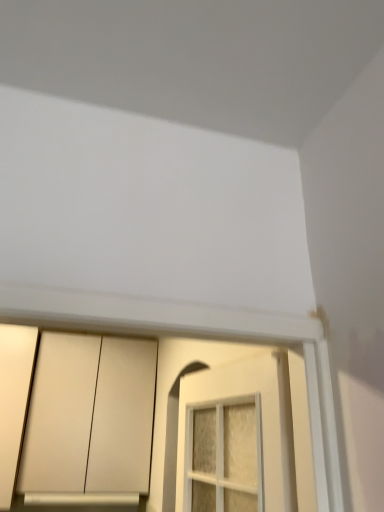
Question: Is matte white cabinet at lower left taller or shorter than matte white door at lower left?

Choices:
 (A) tall
 (B) short

Answer: (B)

Question: Considering the positions of matte white cabinet at lower left and matte white door at lower left in the image, is matte white cabinet at lower left wider or thinner than matte white door at lower left?

Choices:
 (A) wide
 (B) thin

Answer: (A)

Question: Which of these objects is positioned farthest from the matte white door at lower left?

Choices:
 (A) matte white cabinet at lower left
 (B) silver metallic window sill at lower center

Answer: (B)

Question: Considering the real-world distances, which object is farthest from the silver metallic window sill at lower center?

Choices:
 (A) matte white cabinet at lower left
 (B) matte white door at lower left

Answer: (B)